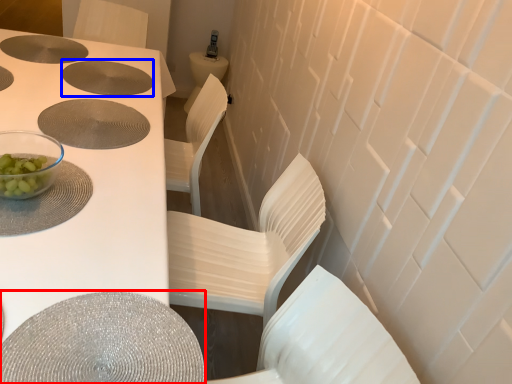
Question: Which object is closer to the camera taking this photo, round table (highlighted by a red box) or hole (highlighted by a blue box)?

Choices:
 (A) round table
 (B) hole

Answer: (A)